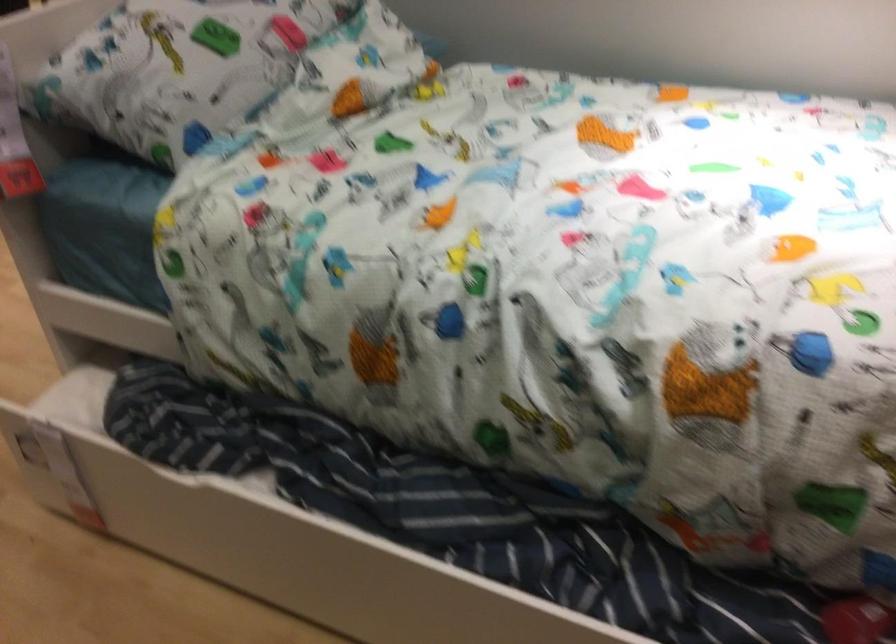
Where would you pull the white drawer handle? Please return your answer as a coordinate pair (x, y).

(24, 448)